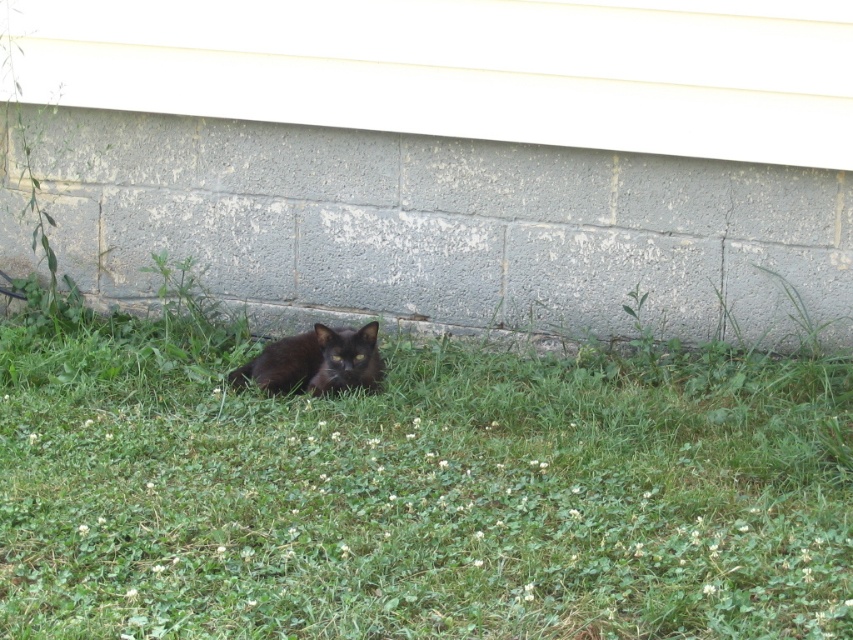
Question: Which of the following is the closest to the observer?

Choices:
 (A) shiny black cat at lower center
 (B) green grass at lower center

Answer: (B)

Question: Is green grass at lower center wider than shiny black cat at lower center?

Choices:
 (A) yes
 (B) no

Answer: (A)

Question: Which point is farther from the camera taking this photo?

Choices:
 (A) (370, 332)
 (B) (535, 588)

Answer: (A)

Question: Does green grass at lower center have a smaller size compared to shiny black cat at lower center?

Choices:
 (A) yes
 (B) no

Answer: (B)

Question: Which point is farther from the camera taking this photo?

Choices:
 (A) (366, 376)
 (B) (730, 529)

Answer: (A)

Question: Can you confirm if green grass at lower center is positioned above shiny black cat at lower center?

Choices:
 (A) no
 (B) yes

Answer: (A)